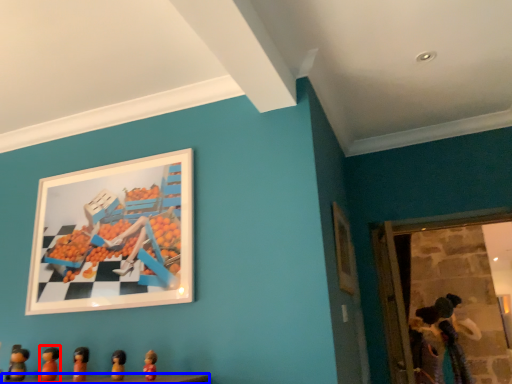
Question: Which object is further to the camera taking this photo, toy (highlighted by a red box) or table (highlighted by a blue box)?

Choices:
 (A) toy
 (B) table

Answer: (A)